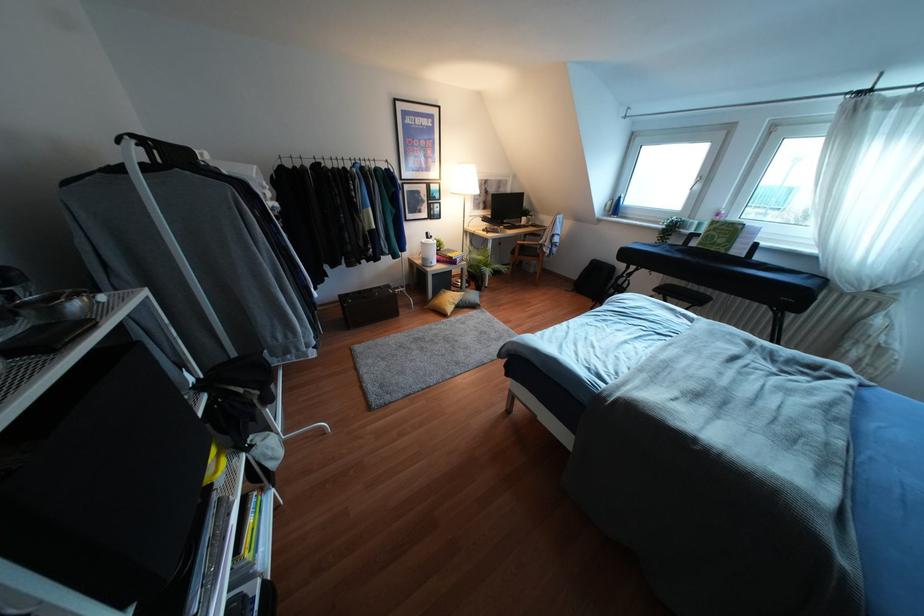
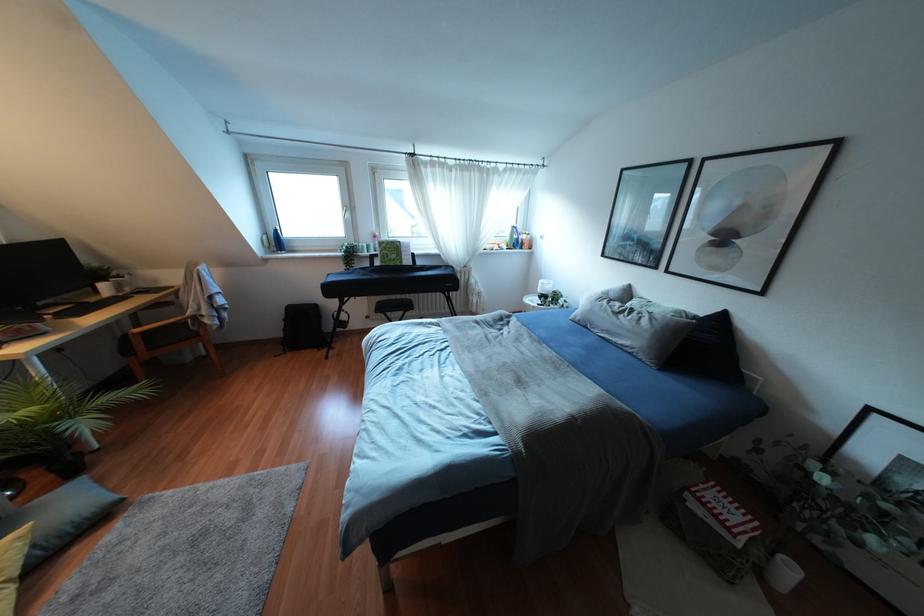
In the second image, find the point that corresponds to pixel 537 256 in the first image.

(196, 334)